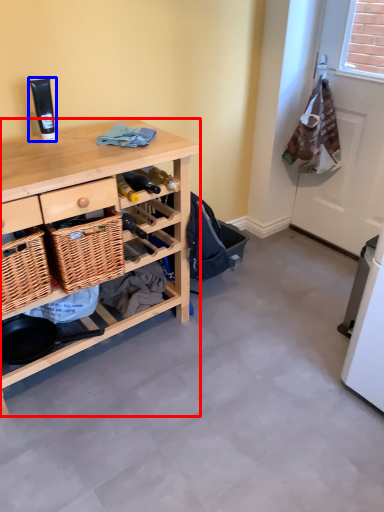
Question: Among these objects, which one is farthest to the camera, desk (highlighted by a red box) or toiletry (highlighted by a blue box)?

Choices:
 (A) desk
 (B) toiletry

Answer: (B)